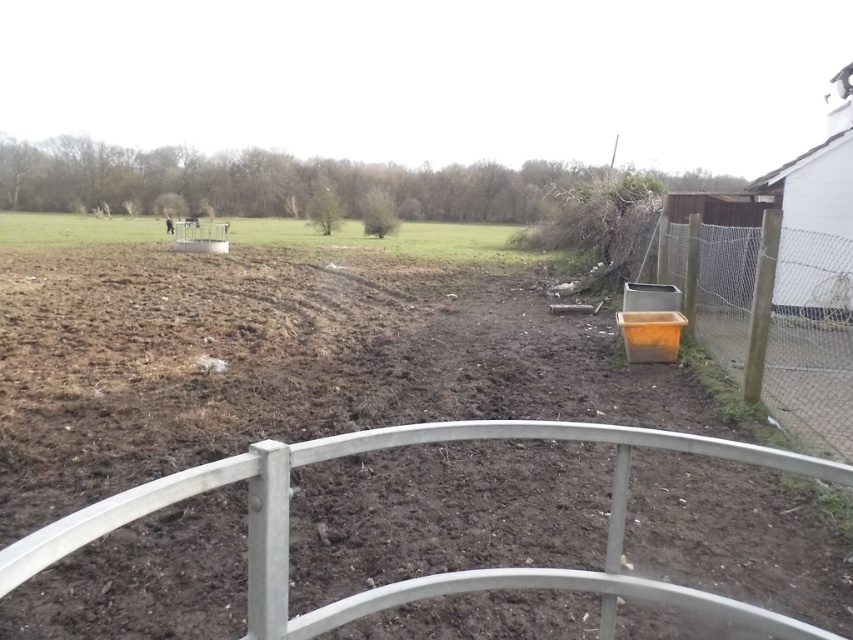
From the picture: Is orange plastic container at right below green grass at upper left?

Indeed, orange plastic container at right is positioned under green grass at upper left.

Consider the image. Which is more to the left, orange plastic container at right or green grass at upper left?

Positioned to the left is green grass at upper left.

At what (x,y) coordinates should I click in order to perform the action: click on orange plastic container at right. Please return your answer as a coordinate pair (x, y). Image resolution: width=853 pixels, height=640 pixels. Looking at the image, I should click on (809, 340).